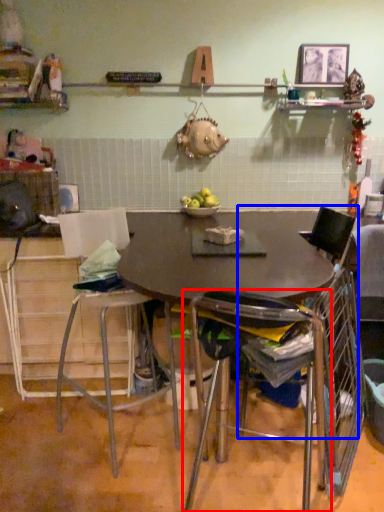
Question: Which object is closer to the camera taking this photo, chair (highlighted by a red box) or chair (highlighted by a blue box)?

Choices:
 (A) chair
 (B) chair

Answer: (A)